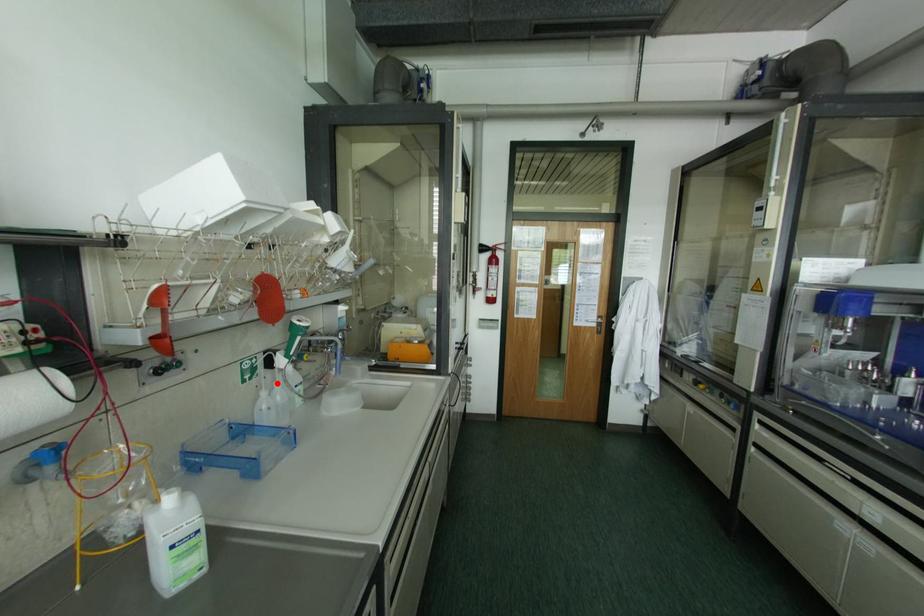
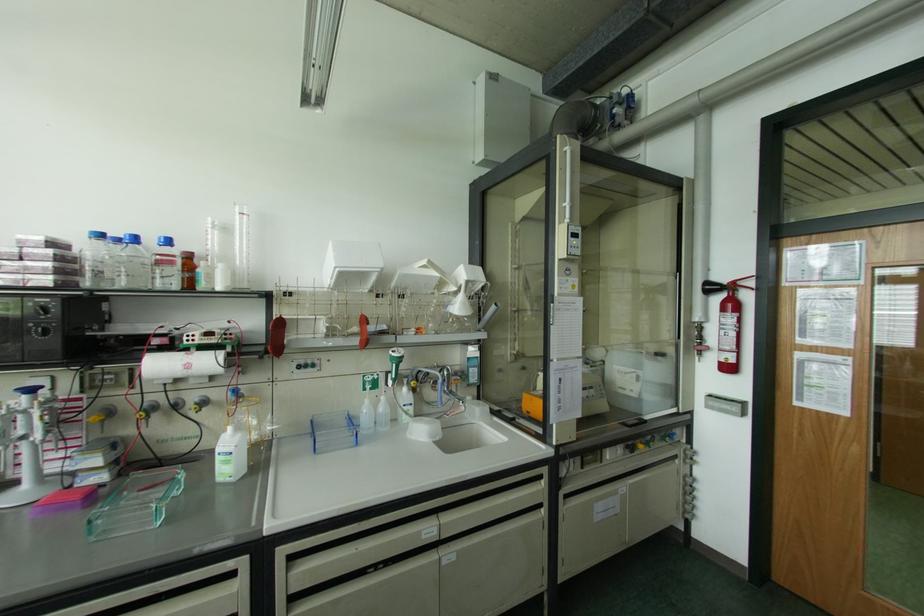
Question: A red point is marked in image1. In image2, is the corresponding 3D point closer to the camera or farther? Reply with the corresponding letter.

Choices:
 (A) The corresponding 3D point is closer.
 (B) The corresponding 3D point is farther.

Answer: (B)